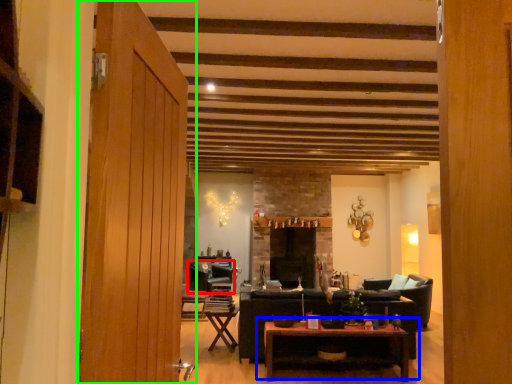
Question: Which object is positioned farthest from chair (highlighted by a red box)? Select from coffee table (highlighted by a blue box) and door (highlighted by a green box).

Choices:
 (A) coffee table
 (B) door

Answer: (B)